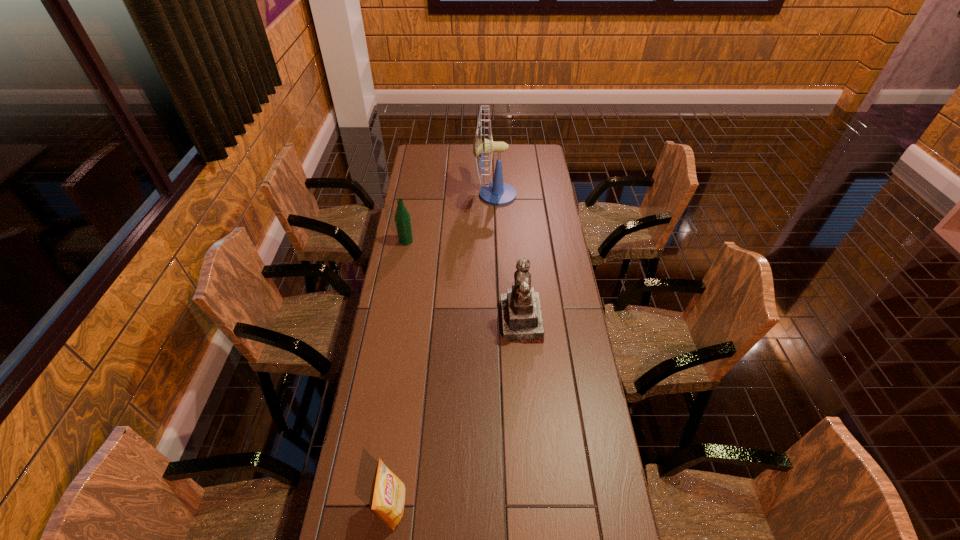
In order to click on unoccupied position between the tallest object and the second shortest object in this screenshot , I will do `click(450, 218)`.

The image size is (960, 540). What are the coordinates of `object that is the third closest to the tallest object` in the screenshot? It's located at (387, 498).

Locate an element on the screen. object that is the second closest to the fan is located at coordinates (522, 321).